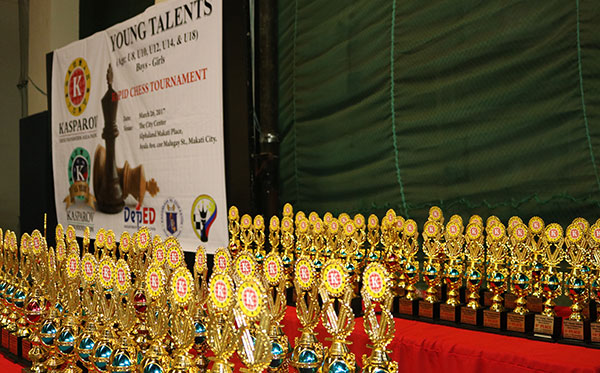
At what (x,y) coordinates should I click in order to perform the action: click on black wires. Please return your answer as a coordinate pair (x, y). Looking at the image, I should click on (39, 88).